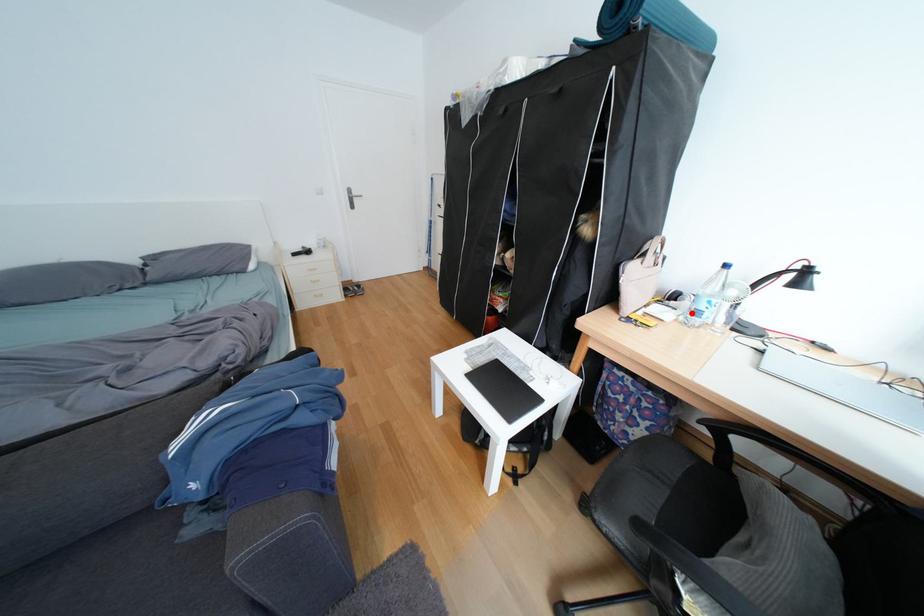
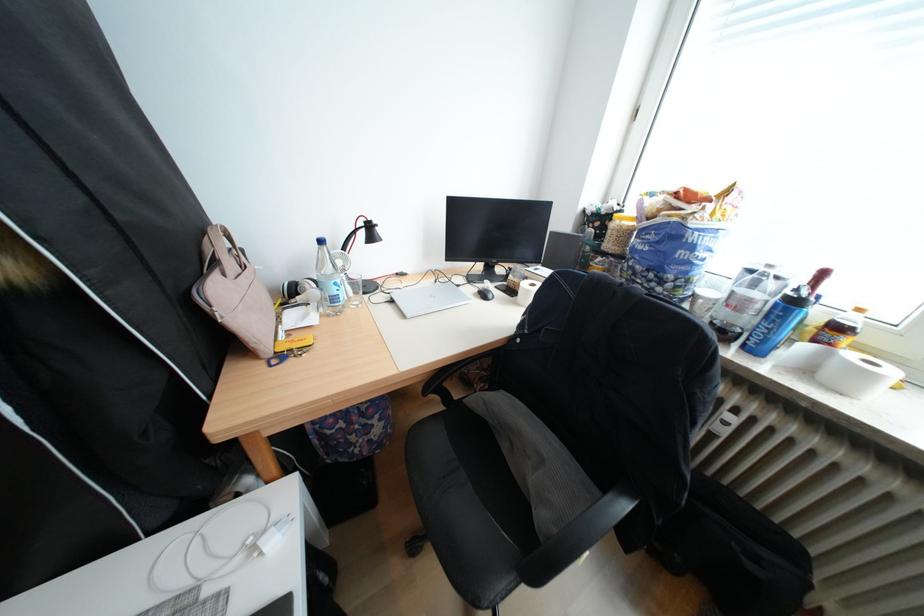
In the second image, find the point that corresponds to the highlighted location in the first image.

(325, 306)